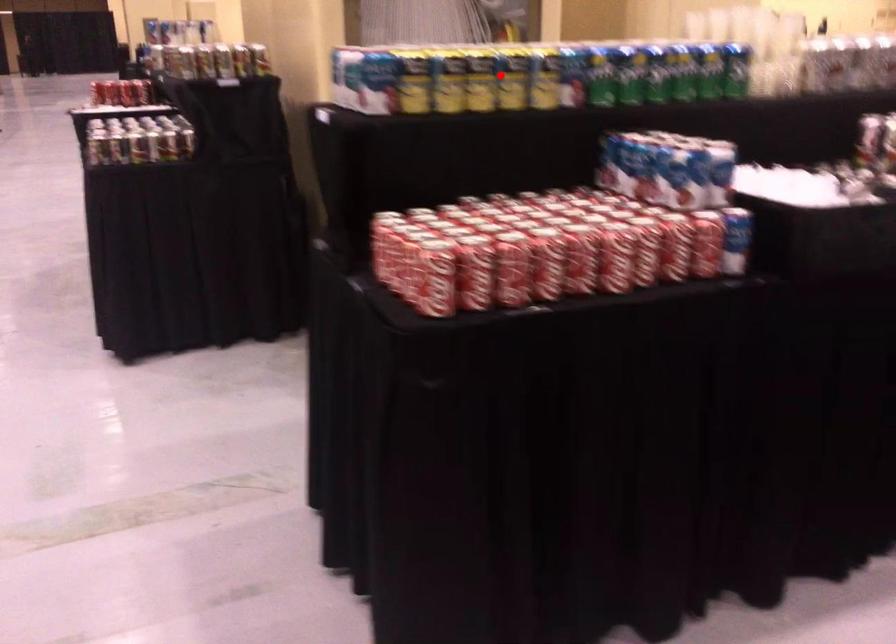
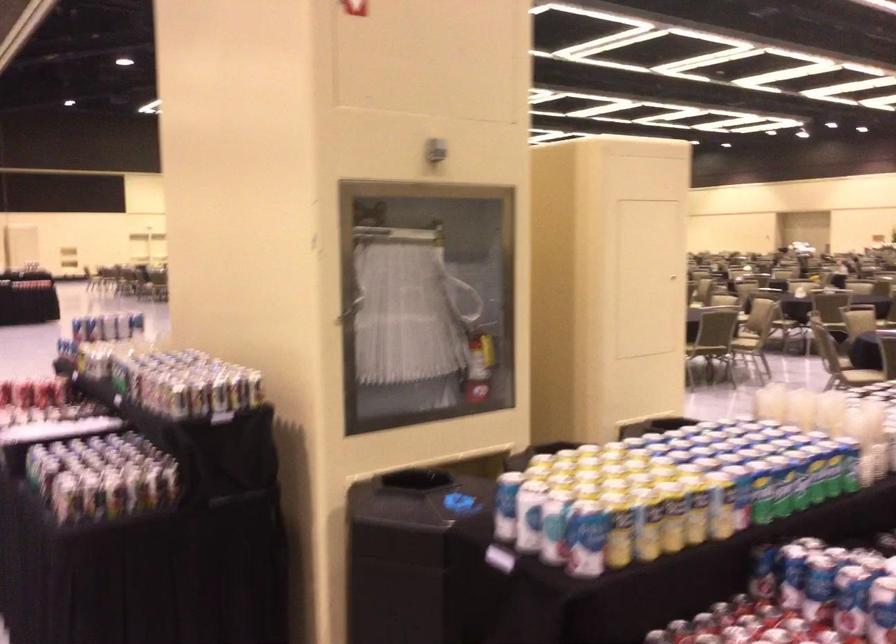
The point at the highlighted location is marked in the first image. Where is the corresponding point in the second image?

(695, 509)